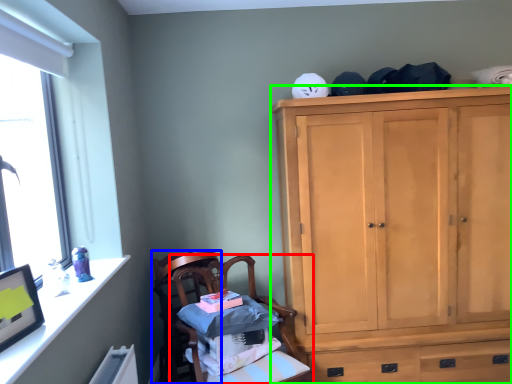
Question: Based on their relative distances, which object is nearer to chair (highlighted by a red box)? Choose from chair (highlighted by a blue box) and cabinetry (highlighted by a green box).

Choices:
 (A) chair
 (B) cabinetry

Answer: (A)